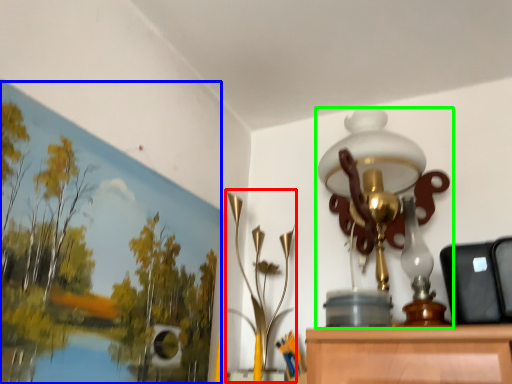
Question: Considering the real-world distances, which object is farthest from lamp (highlighted by a red box)? oil painting (highlighted by a blue box) or lamp (highlighted by a green box)?

Choices:
 (A) oil painting
 (B) lamp

Answer: (A)